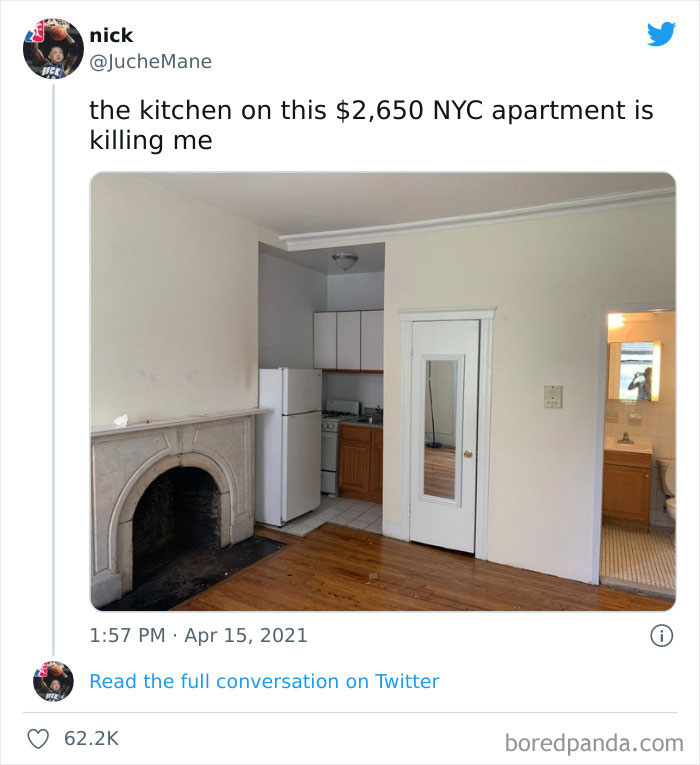
The height and width of the screenshot is (765, 700). Find the location of `tile`. tile is located at coordinates (628, 562).